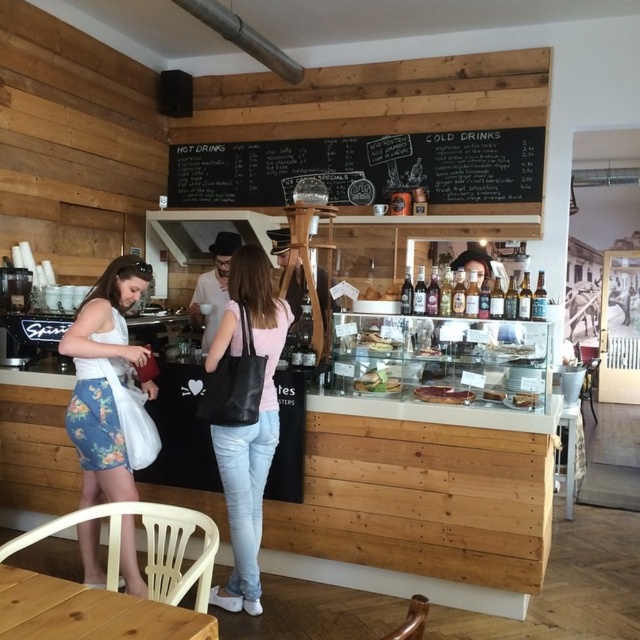
You are a customer at the rustic wooden cafe and you want to place your floral denim skirt at lower left next to the matte white cake at center. Will the skirt be taller than the cake?

The floral denim skirt at lower left is much taller than the matte white cake at center, so yes, the skirt will be taller than the cake when placed next to it.

You are a customer at the cozy rustic wooden aesthetic cafe. You see the black chalkboard at upper center and the matte glass cake at center. Which object is positioned to the left when viewed from your perspective?

The black chalkboard at upper center is positioned to the left of the matte glass cake at center.